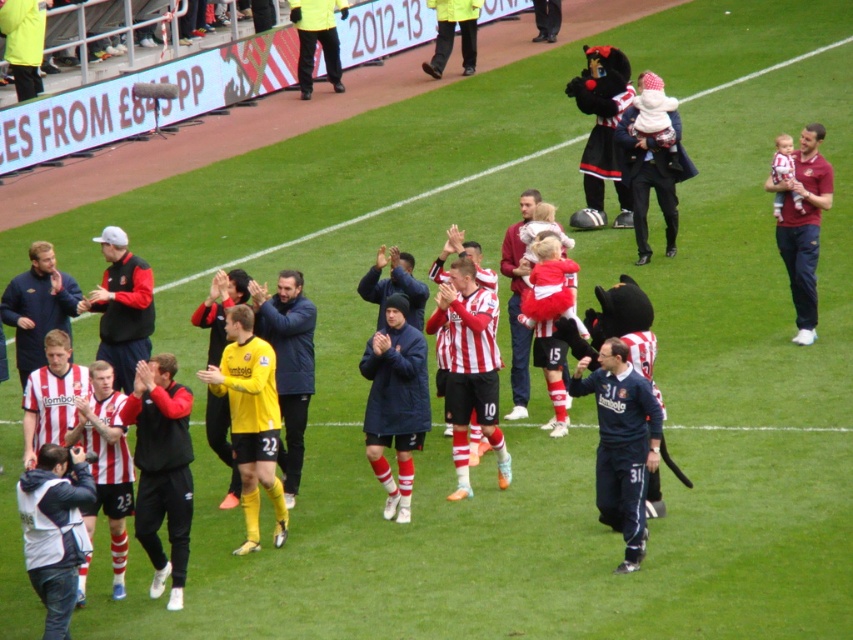
Question: Observing the image, what is the correct spatial positioning of dark blue jersey at center in reference to matte blue jacket at center?

Choices:
 (A) left
 (B) right

Answer: (B)

Question: Is the position of black track pants at center more distant than that of yellow uniform at upper left?

Choices:
 (A) yes
 (B) no

Answer: (B)

Question: Which object appears closest to the camera in this image?

Choices:
 (A) black track pants at center
 (B) maroon jersey at right
 (C) yellow uniform at upper left
 (D) matte black jacket at center

Answer: (A)

Question: Among these objects, which one is farthest from the camera?

Choices:
 (A) blue jacket at center
 (B) maroon jersey at right

Answer: (B)

Question: Is blue jacket at center in front of maroon jersey at right?

Choices:
 (A) yes
 (B) no

Answer: (A)

Question: Which of the following is the closest to the observer?

Choices:
 (A) (229, 484)
 (B) (125, 276)

Answer: (A)